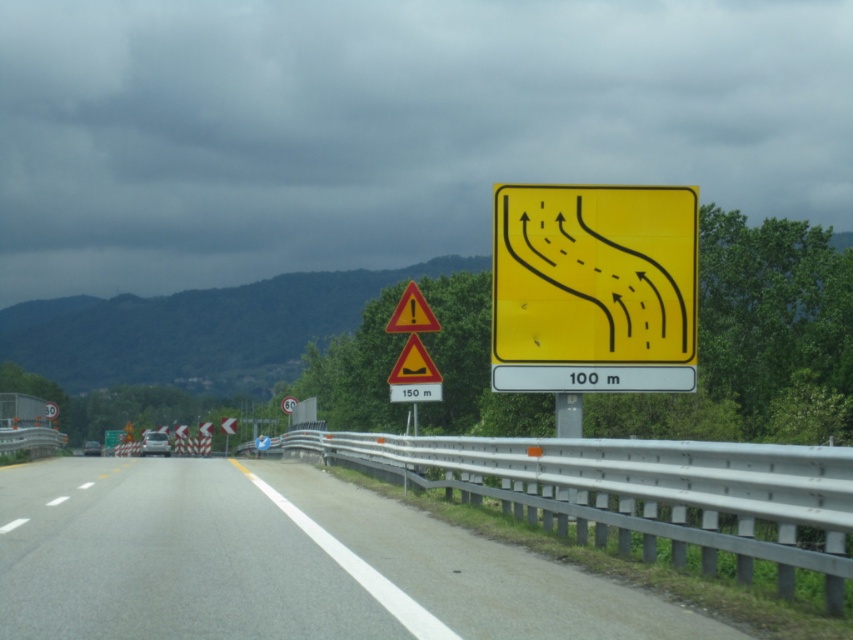
You are driving a car and see the gray asphalt road at center and the yellow plastic road sign at upper right. Which object is closer to you?

The gray asphalt road at center is closer to you because it is in front of the yellow plastic road sign at upper right.

You are a driver approaching the gray asphalt road at center and see the yellow plastic road sign at upper right. Which object is bigger in the image?

The gray asphalt road at center is larger in size compared to the yellow plastic road sign at upper right.

You are a driver approaching the gray asphalt road at center and the yellow plastic road sign at upper right. Which object is wider?

The gray asphalt road at center is wider than the yellow plastic road sign at upper right.